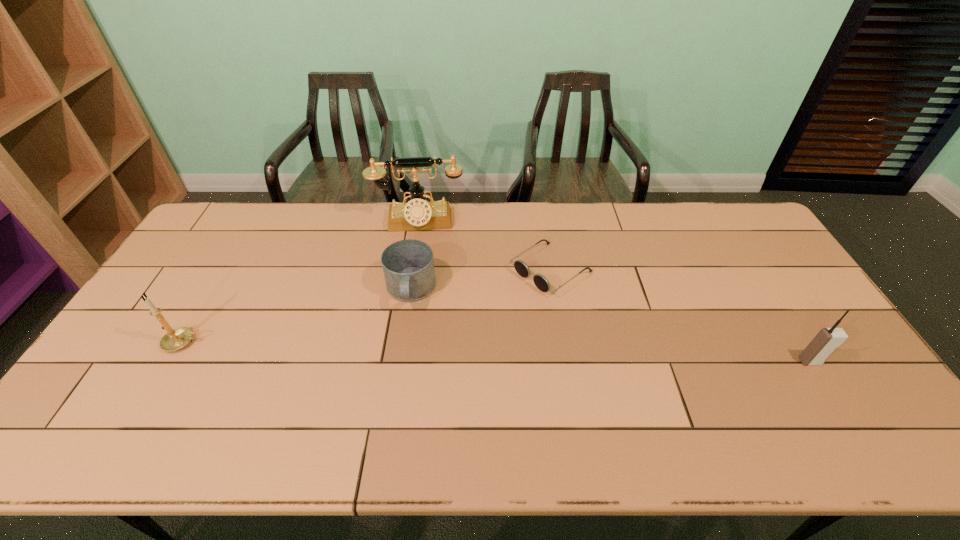
The height and width of the screenshot is (540, 960). I want to click on telephone that is positioned at the far edge, so click(418, 214).

At what (x,y) coordinates should I click in order to perform the action: click on object present at the left edge. Please return your answer as a coordinate pair (x, y). The height and width of the screenshot is (540, 960). Looking at the image, I should click on (175, 339).

Identify the location of object that is at the right edge. Image resolution: width=960 pixels, height=540 pixels. (824, 343).

In the image, there is a desktop. In order to click on vacant space at the far edge in this screenshot , I will do `click(362, 212)`.

What are the coordinates of `vacant point at the near edge` in the screenshot? It's located at (442, 393).

Identify the location of vacant area at the left edge of the desktop. The image size is (960, 540). (188, 306).

In the image, there is a desktop. Where is `vacant region at the far left corner`? vacant region at the far left corner is located at coordinates (254, 202).

Image resolution: width=960 pixels, height=540 pixels. Find the location of `free space at the far right corner of the desktop`. free space at the far right corner of the desktop is located at coordinates (719, 227).

Locate an element on the screen. This screenshot has height=540, width=960. vacant point located between the fourth tallest object and the second object from right to left is located at coordinates (481, 280).

In order to click on vacant point located between the nearest object and the tallest object in this screenshot , I will do `click(614, 292)`.